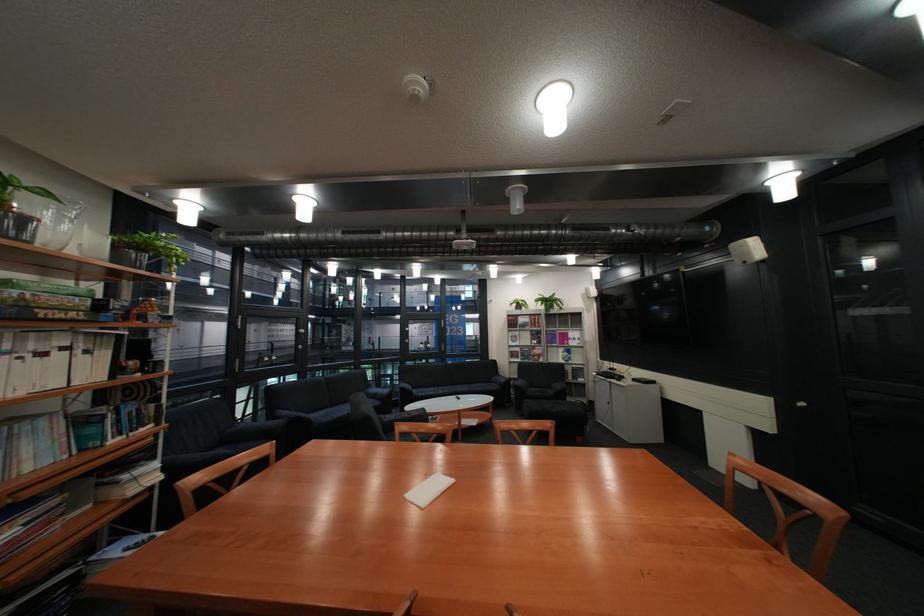
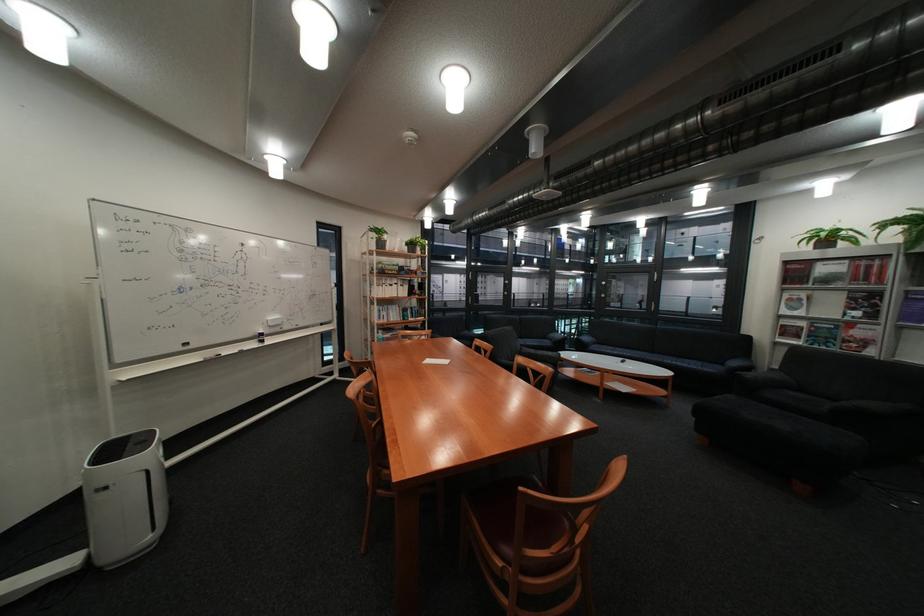
Locate, in the second image, the point that corresponds to point 505,382 in the first image.

(737, 363)